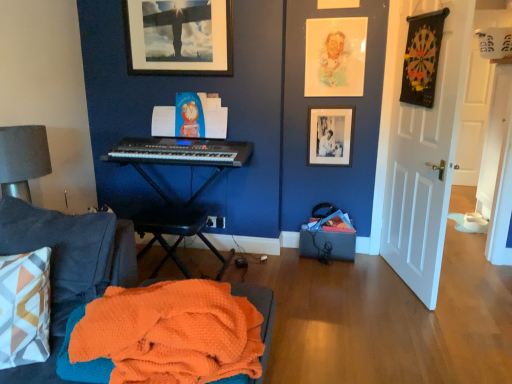
The height and width of the screenshot is (384, 512). Identify the location of vacant space to the right of white matte door at right. (473, 286).